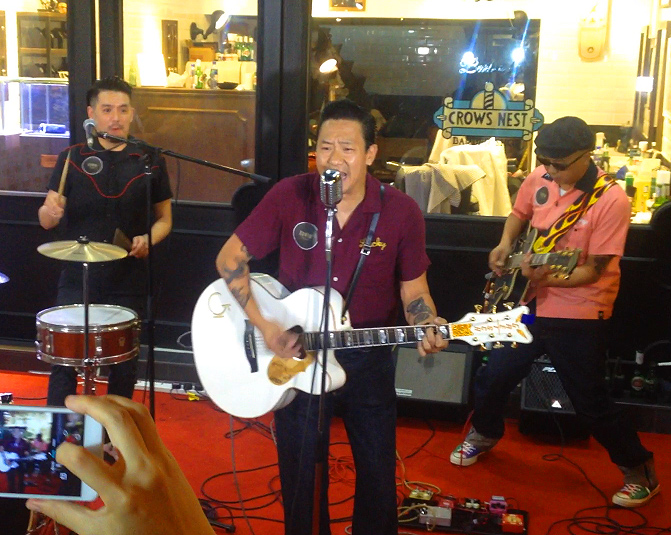
Where is `cord`? The image size is (671, 535). cord is located at coordinates (606, 516).